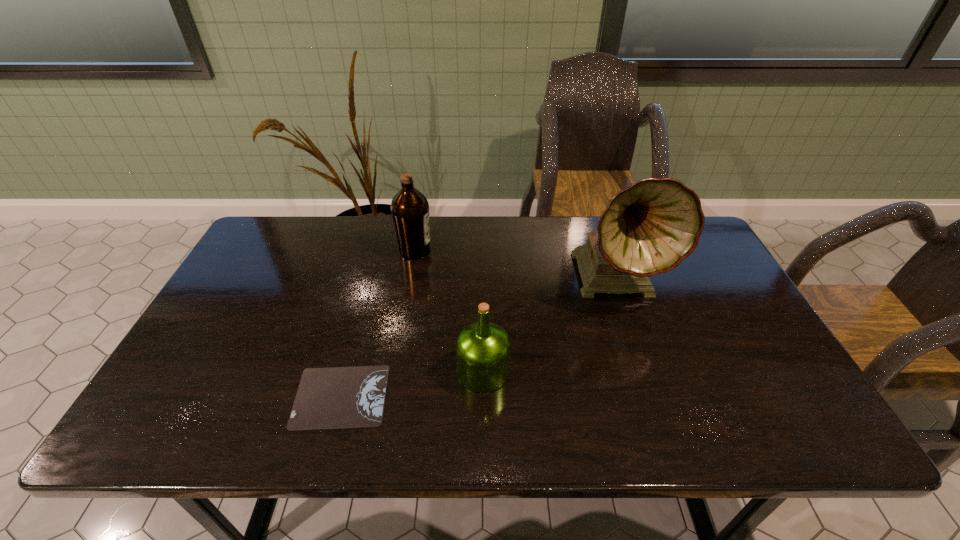
Find the location of `vacant space that's between the second tallest object and the mousepad`. vacant space that's between the second tallest object and the mousepad is located at coordinates (378, 323).

What are the coordinates of `vacant region between the rightmost object and the farther olive oil` in the screenshot? It's located at (516, 265).

Image resolution: width=960 pixels, height=540 pixels. I want to click on free space between the third object from left to right and the rightmost object, so click(x=550, y=325).

This screenshot has width=960, height=540. What are the coordinates of `vacant area that lies between the record player and the third tallest object` in the screenshot? It's located at (550, 325).

Where is `free spot between the nearer olive oil and the tallest object`? This screenshot has height=540, width=960. free spot between the nearer olive oil and the tallest object is located at coordinates (550, 325).

What are the coordinates of `unoccupied position between the shortest object and the left olive oil` in the screenshot? It's located at [378, 323].

Locate an element on the screen. The width and height of the screenshot is (960, 540). free space between the rightmost object and the second shortest object is located at coordinates (550, 325).

Where is `vacant space that's between the rightmost object and the farther olive oil`? vacant space that's between the rightmost object and the farther olive oil is located at coordinates (516, 265).

The width and height of the screenshot is (960, 540). Identify the location of empty space that is in between the tallest object and the right olive oil. click(550, 325).

You are a GUI agent. You are given a task and a screenshot of the screen. Output one action in this format:
    pyautogui.click(x=<x>, y=<y>)
    Task: Click on the object that can be found as the third closest to the record player
    This screenshot has width=960, height=540.
    Given the screenshot: What is the action you would take?
    pyautogui.click(x=339, y=397)